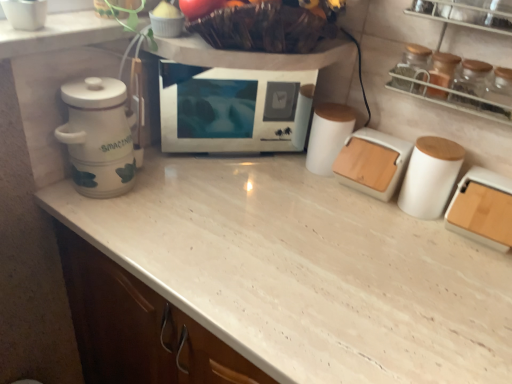
Identify the location of empty space that is to the right of white ceramic canister at left. This screenshot has width=512, height=384. (180, 204).